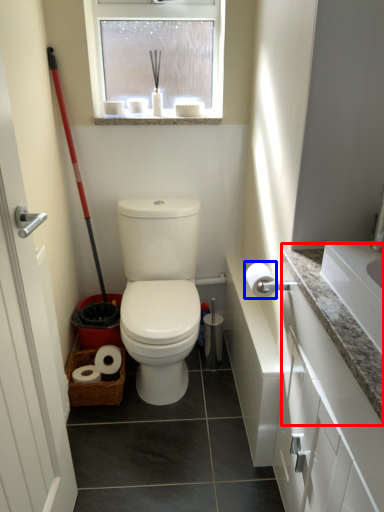
Question: Which object is further to the camera taking this photo, counter top (highlighted by a red box) or toilet paper (highlighted by a blue box)?

Choices:
 (A) counter top
 (B) toilet paper

Answer: (B)